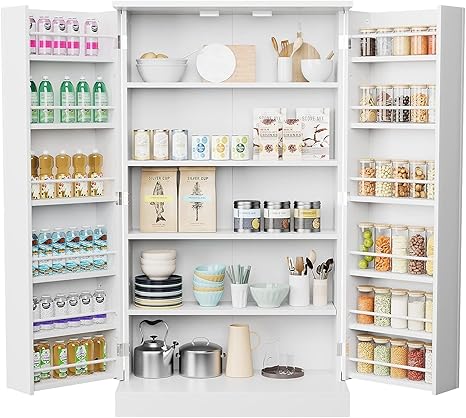
This screenshot has height=418, width=466. Find the location of `bottles on shelf above bottom shelf on left side`. bottles on shelf above bottom shelf on left side is located at coordinates (99, 299), (84, 304), (72, 304), (60, 309), (47, 309), (35, 313).